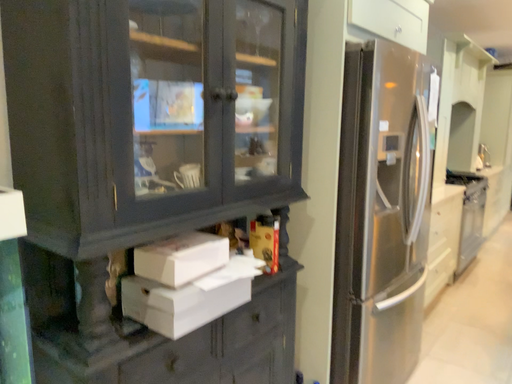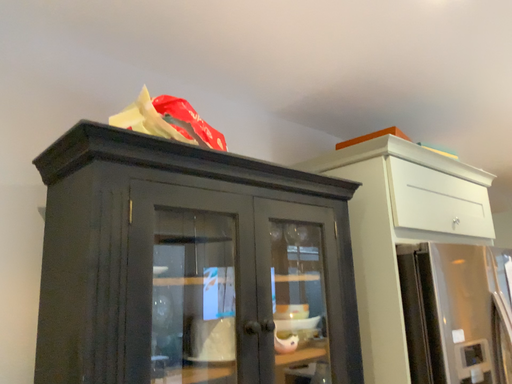
Question: How did the camera likely rotate when shooting the video?

Choices:
 (A) rotated right
 (B) rotated left

Answer: (B)